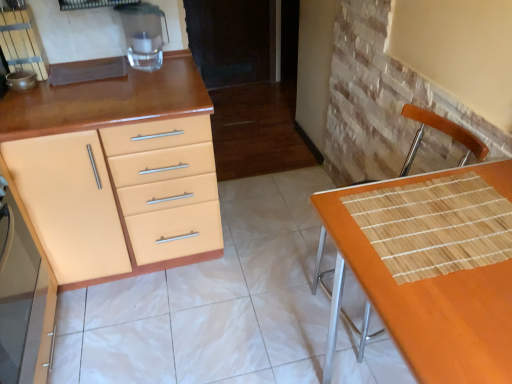
Question: In terms of height, does matte orange cabinet at left, acting as the second cabinetry starting from the front, look taller or shorter compared to matte beige cabinet at left, the 2th cabinetry from the back?

Choices:
 (A) tall
 (B) short

Answer: (A)

Question: Based on their sizes in the image, would you say matte orange cabinet at left, acting as the second cabinetry starting from the front, is bigger or smaller than matte beige cabinet at left, the 2th cabinetry from the back?

Choices:
 (A) big
 (B) small

Answer: (A)

Question: Based on their relative distances, which object is nearer to the transparent glass water at upper left?

Choices:
 (A) orange woven mat at lower right
 (B) matte orange cabinet at left, the 1th cabinetry from the back
 (C) matte beige cabinet at left, the first cabinetry viewed from the front

Answer: (B)

Question: Which of these objects is positioned farthest from the orange woven mat at lower right?

Choices:
 (A) matte beige cabinet at left, the 2th cabinetry from the back
 (B) matte orange cabinet at left, the 1th cabinetry from the back
 (C) transparent glass water at upper left

Answer: (C)